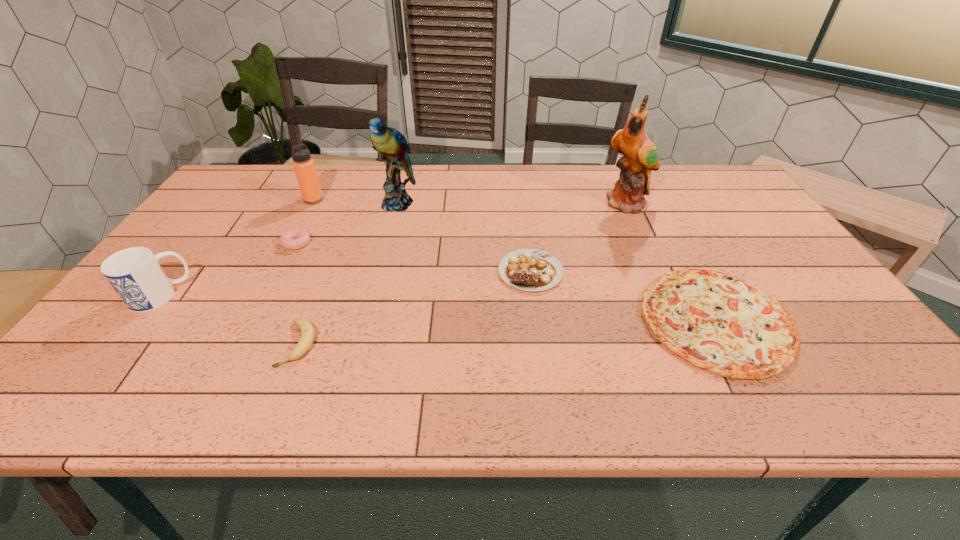
Where is `object that is at the near edge`? object that is at the near edge is located at coordinates (718, 322).

In order to click on object that is positioned at the left edge in this screenshot , I will do `click(135, 274)`.

This screenshot has width=960, height=540. Find the location of `object located at the right edge`. object located at the right edge is located at coordinates (718, 322).

At what (x,y) coordinates should I click in order to perform the action: click on object situated at the near right corner. Please return your answer as a coordinate pair (x, y). Image resolution: width=960 pixels, height=540 pixels. Looking at the image, I should click on (718, 322).

Locate an element on the screen. Image resolution: width=960 pixels, height=540 pixels. vacant space at the far edge of the desktop is located at coordinates (359, 191).

Identify the location of free location at the near edge. The width and height of the screenshot is (960, 540). (548, 393).

Find the location of `vacant space at the left edge`. vacant space at the left edge is located at coordinates (209, 231).

Locate an element on the screen. The image size is (960, 540). vacant area at the right edge of the desktop is located at coordinates (757, 223).

Identify the location of blank space at the far left corner of the desktop. (244, 191).

At what (x,y) coordinates should I click in order to perform the action: click on empty space that is in between the fourth object from right to left and the leftmost object. Please return your answer as a coordinate pair (x, y). The width and height of the screenshot is (960, 540). Looking at the image, I should click on (278, 249).